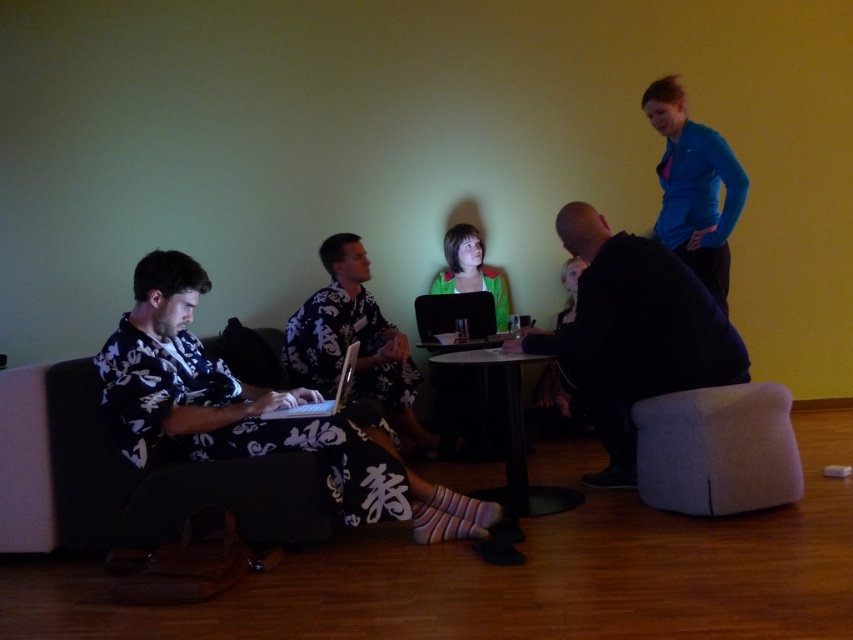
You are planning to hang a picture frame that requires a hook 1.2 meters high on the wall. Considering the positions of the white floral shirt at left and the blue fleece jacket at upper right, which clothing item would be in the way if you place the hook at that height?

The blue fleece jacket at upper right would be in the way because it is taller than the white floral shirt at left, making it more likely to obstruct the hook placed at 1.2 meters high.

You are a photographer setting up for a group photo in the room. You notice the black matte jacket at center and the black glossy laptop at center. Which object should you adjust to ensure the laptop is visible in the photo?

The black matte jacket at center is below the black glossy laptop at center. To ensure the laptop is visible, you should adjust the jacket so it doesn not block the laptop.